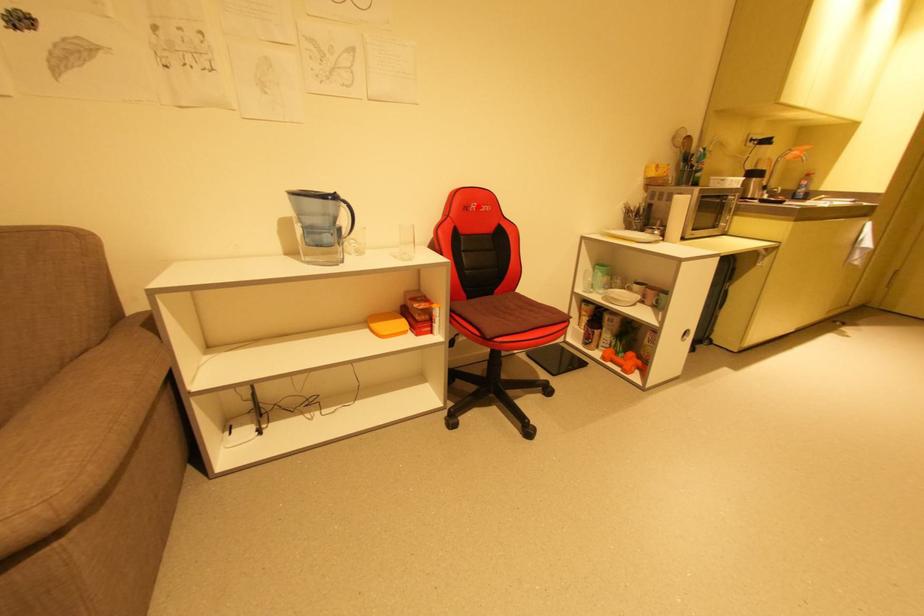
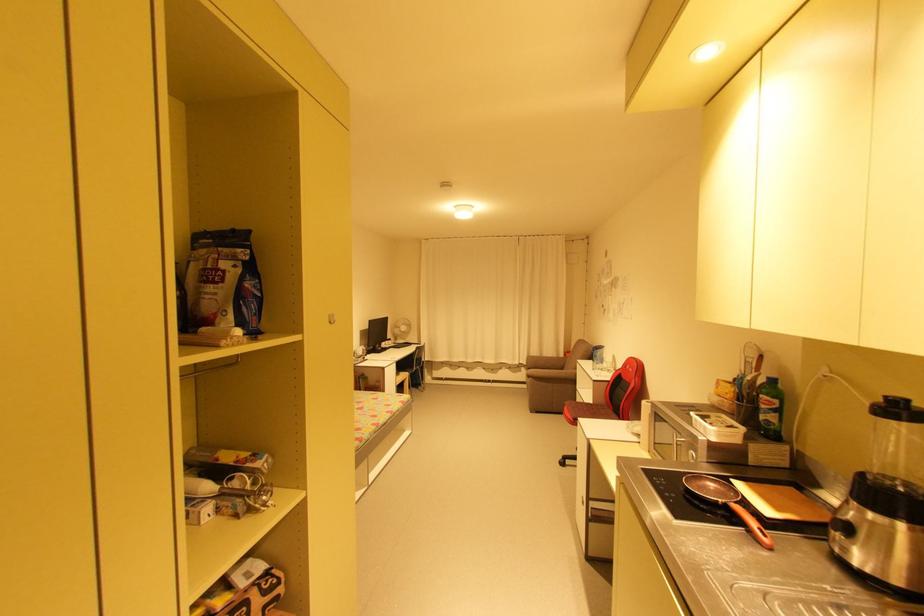
Find the pixel in the second image that matches the highlighted location in the first image.

(631, 367)